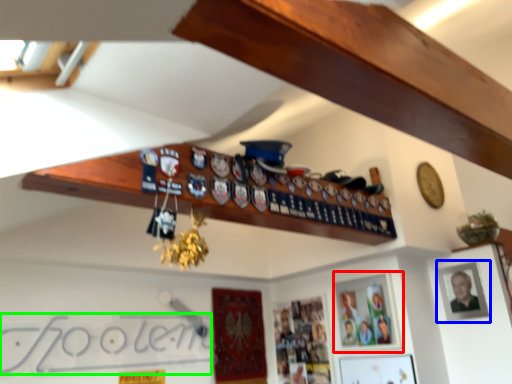
Question: Which object is the farthest from picture frame (highlighted by a red box)? Choose among these: picture frame (highlighted by a blue box) or signature (highlighted by a green box).

Choices:
 (A) picture frame
 (B) signature

Answer: (B)